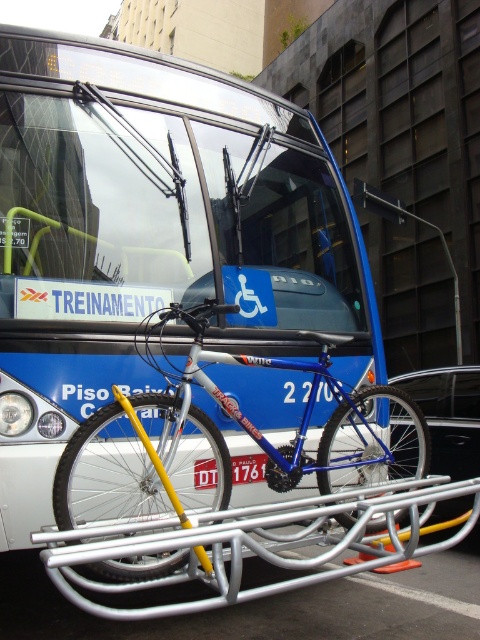
Question: Can you confirm if silver metallic bike rack at center is wider than white plastic license plate at center?

Choices:
 (A) yes
 (B) no

Answer: (A)

Question: Which of the following is the farthest from the observer?

Choices:
 (A) pyautogui.click(x=124, y=419)
 (B) pyautogui.click(x=130, y=353)
 (C) pyautogui.click(x=241, y=461)

Answer: (C)

Question: Is blue matte bus at center closer to camera compared to blue metallic bicycle at center?

Choices:
 (A) yes
 (B) no

Answer: (B)

Question: Which of these objects is positioned closest to the blue metallic bicycle at center?

Choices:
 (A) blue matte bus at center
 (B) silver metallic bike rack at center

Answer: (B)

Question: Which object appears farthest from the camera in this image?

Choices:
 (A) blue matte bus at center
 (B) white plastic license plate at center
 (C) silver metallic bike rack at center

Answer: (B)

Question: Does blue matte bus at center appear on the left side of white plastic license plate at center?

Choices:
 (A) yes
 (B) no

Answer: (A)